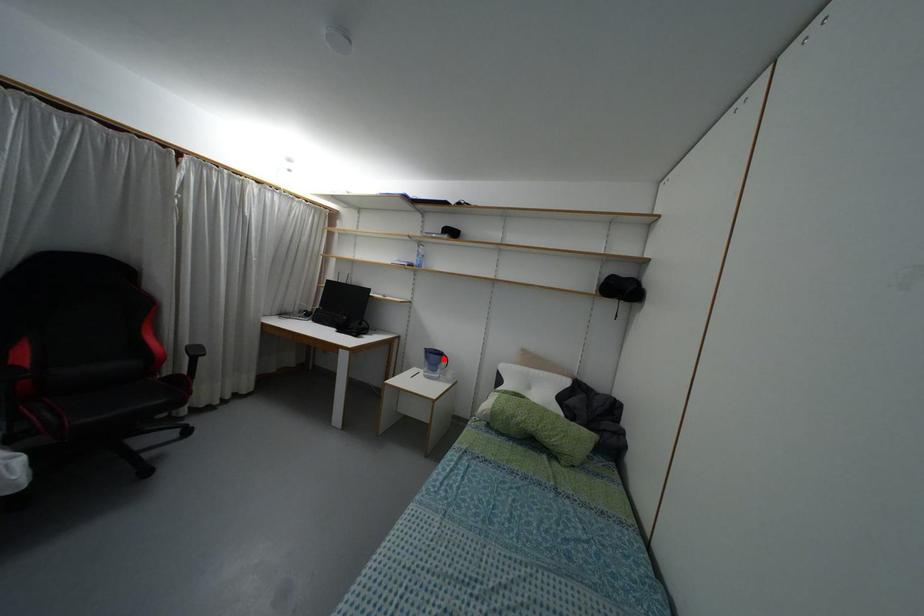
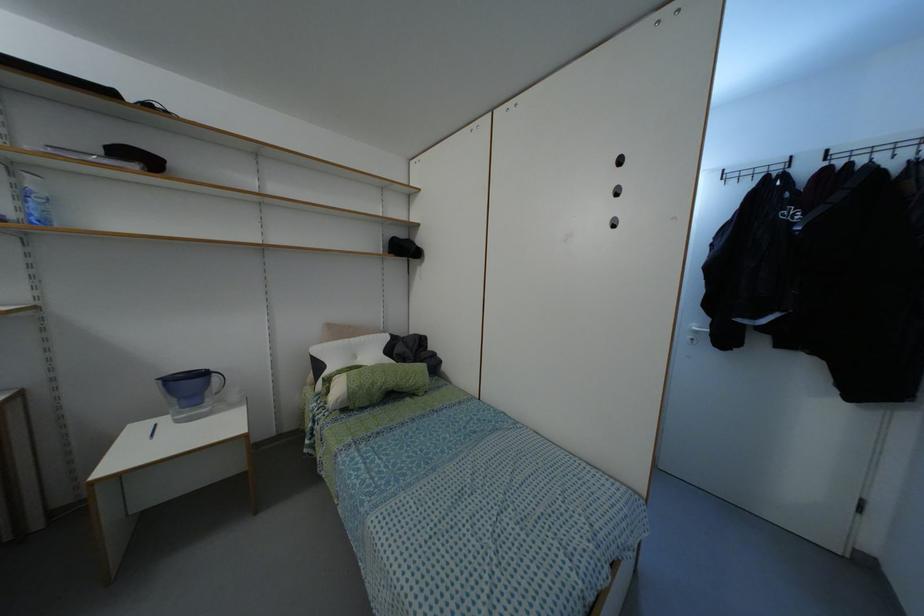
In the second image, find the point that corresponds to the highlighted location in the first image.

(214, 378)